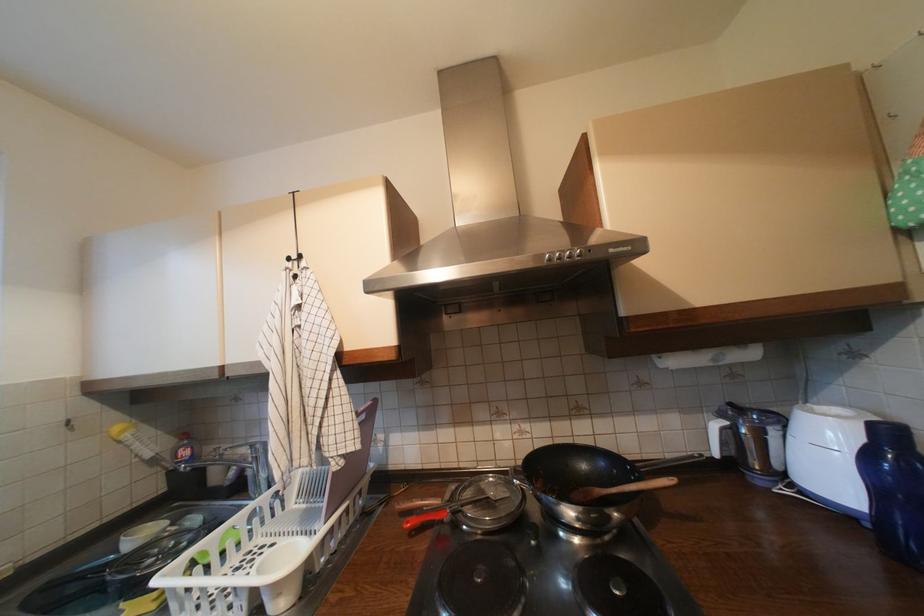
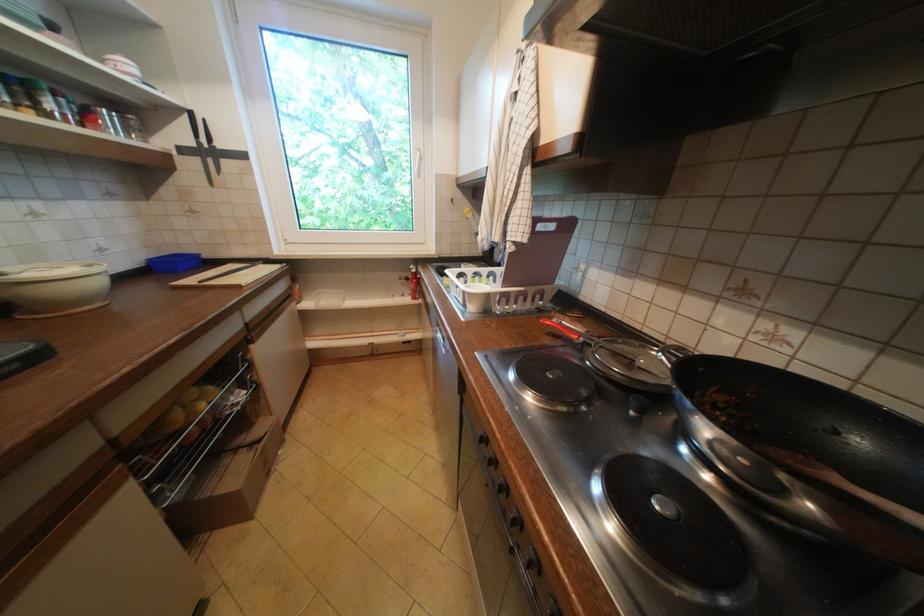
Where in the second image is the point corresponding to the point at 391,498 from the first image?

(565, 310)